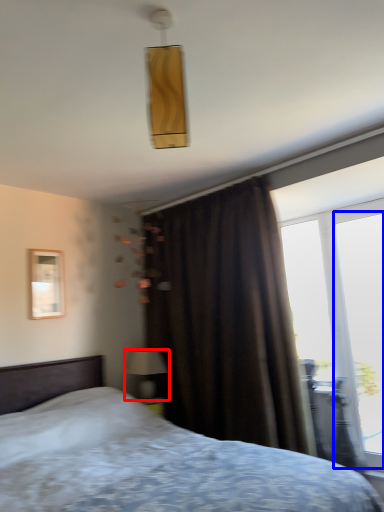
Question: Which point is further to the camera, table lamp (highlighted by a red box) or window (highlighted by a blue box)?

Choices:
 (A) table lamp
 (B) window

Answer: (A)